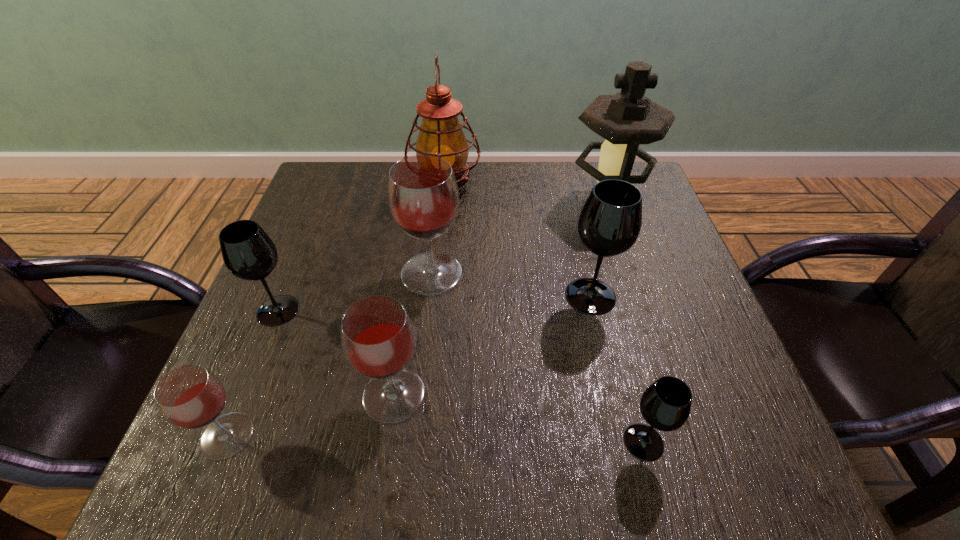
This screenshot has width=960, height=540. Identify the location of the left oil lamp. (440, 134).

At what (x,y) coordinates should I click in order to perform the action: click on the right oil lamp. Please return your answer as a coordinate pair (x, y). This screenshot has height=540, width=960. Looking at the image, I should click on (627, 119).

Where is `the biggest red wineglass`? This screenshot has height=540, width=960. the biggest red wineglass is located at coordinates (422, 193).

I want to click on the biggest gray wineglass, so click(x=610, y=221).

Locate an element on the screen. This screenshot has height=540, width=960. the leftmost gray wineglass is located at coordinates (248, 252).

You are a GUI agent. You are given a task and a screenshot of the screen. Output one action in this format:
    pyautogui.click(x=<x>, y=<y>)
    Task: Click on the second smallest red wineglass
    
    Given the screenshot: What is the action you would take?
    pyautogui.click(x=378, y=339)

Find the location of a particular element. This screenshot has width=960, height=540. the nearest gray wineglass is located at coordinates (665, 405).

The width and height of the screenshot is (960, 540). In order to click on the smallest red wineglass in this screenshot , I will do `click(190, 397)`.

Where is `free space located 0.120m on the right of the left oil lamp`? Image resolution: width=960 pixels, height=540 pixels. free space located 0.120m on the right of the left oil lamp is located at coordinates (526, 188).

The image size is (960, 540). What are the coordinates of `blank space located 0.320m on the front of the right oil lamp` in the screenshot? It's located at (649, 332).